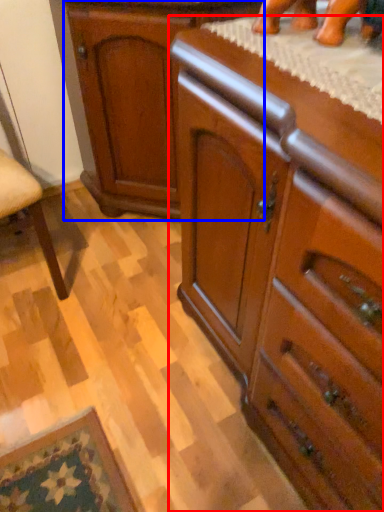
Question: Which point is closer to the camera, chest of drawers (highlighted by a red box) or cabinetry (highlighted by a blue box)?

Choices:
 (A) chest of drawers
 (B) cabinetry

Answer: (A)